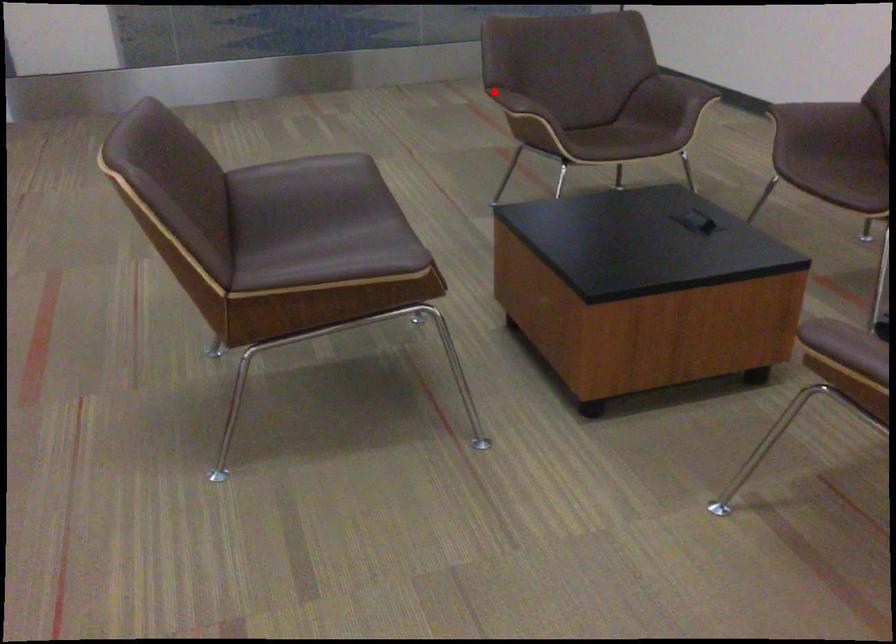
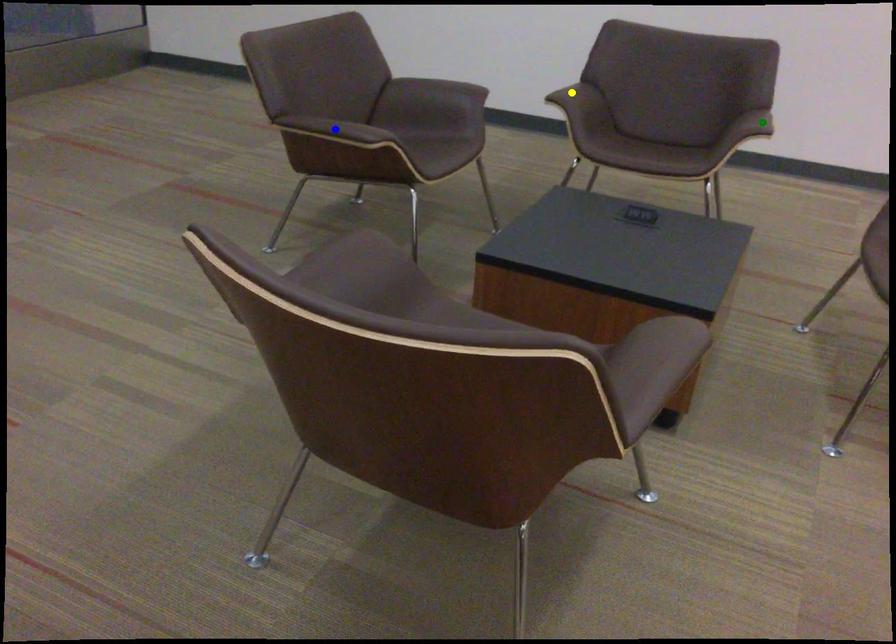
Question: I am providing you with two images of the same scene from different viewpoints. A red point is marked on the first image. You are given multiple points on the second image. Which point in image 2 represents the same 3d spot as the red point in image 1?

Choices:
 (A) yellow point
 (B) green point
 (C) blue point

Answer: (C)